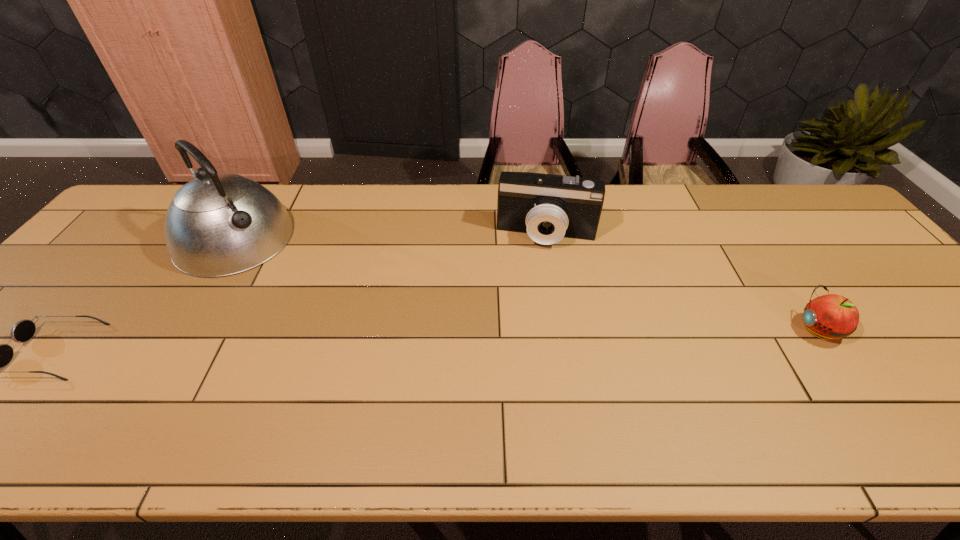
You are a GUI agent. You are given a task and a screenshot of the screen. Output one action in this format:
    pyautogui.click(x=<x>, y=<y>)
    Task: Click on the free space on the desktop that is between the shortest object and the apple and is positioned on the lens of the camcorder
    This screenshot has height=540, width=960.
    Given the screenshot: What is the action you would take?
    pyautogui.click(x=535, y=337)

Find the location of a particular element. This screenshot has width=960, height=540. vacant space on the desktop that is between the shortest object and the apple and is positioned from the spout of the third object from right to left is located at coordinates (347, 343).